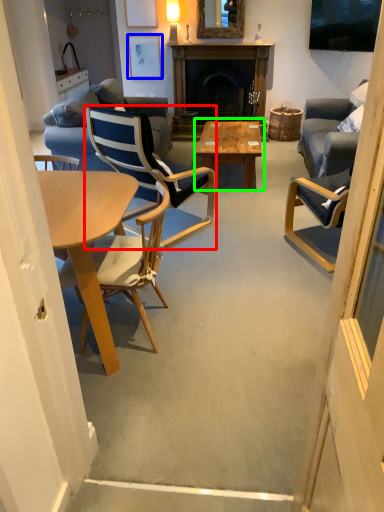
Question: Which is farther away from chair (highlighted by a red box)? picture frame (highlighted by a blue box) or coffee table (highlighted by a green box)?

Choices:
 (A) picture frame
 (B) coffee table

Answer: (A)